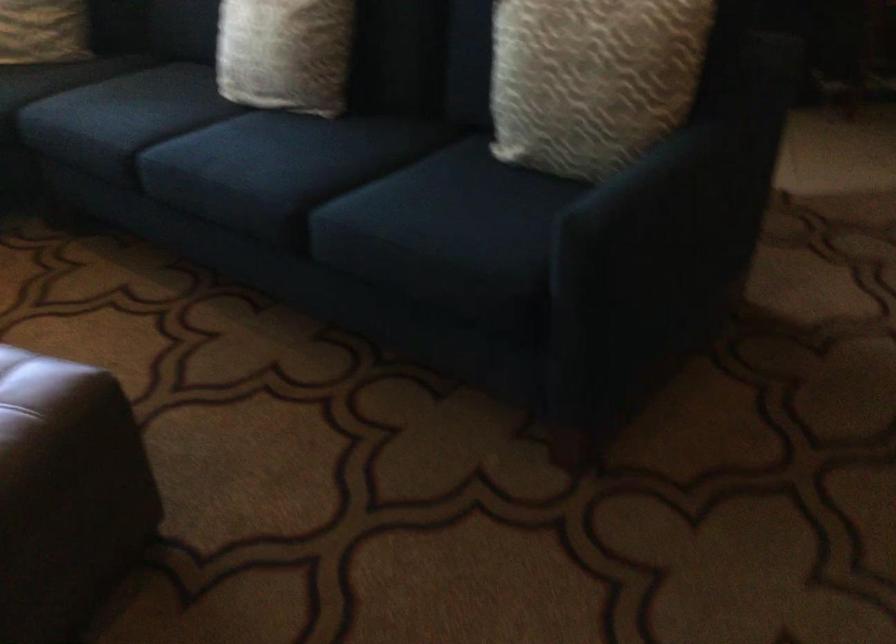
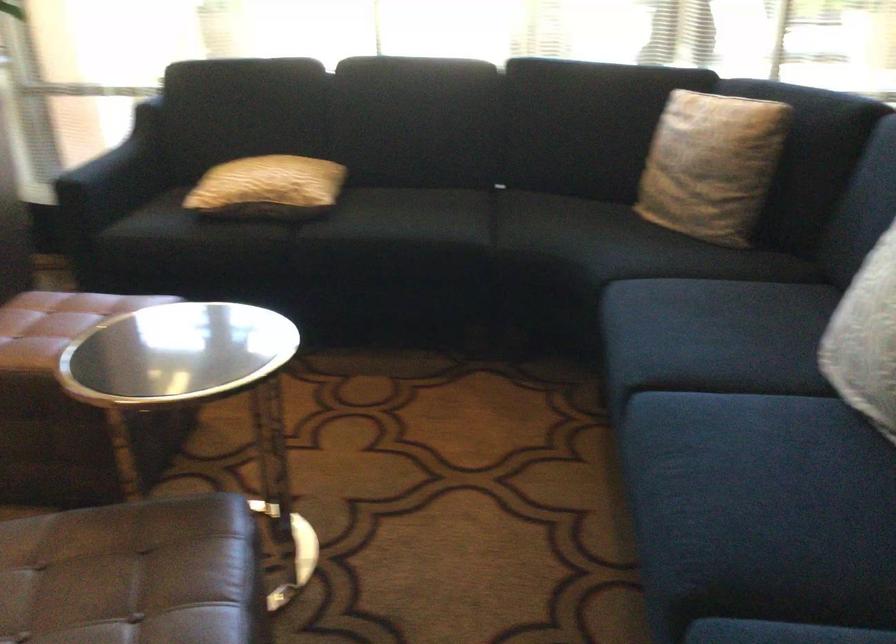
In the second image, find the point that corresponds to point 248,149 in the first image.

(745, 459)